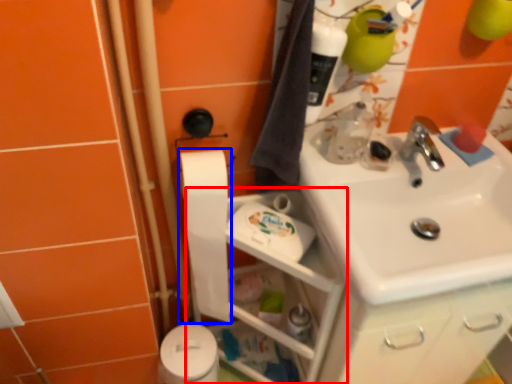
Question: Which point is further to the camera, shelf (highlighted by a red box) or toilet paper (highlighted by a blue box)?

Choices:
 (A) shelf
 (B) toilet paper

Answer: (B)